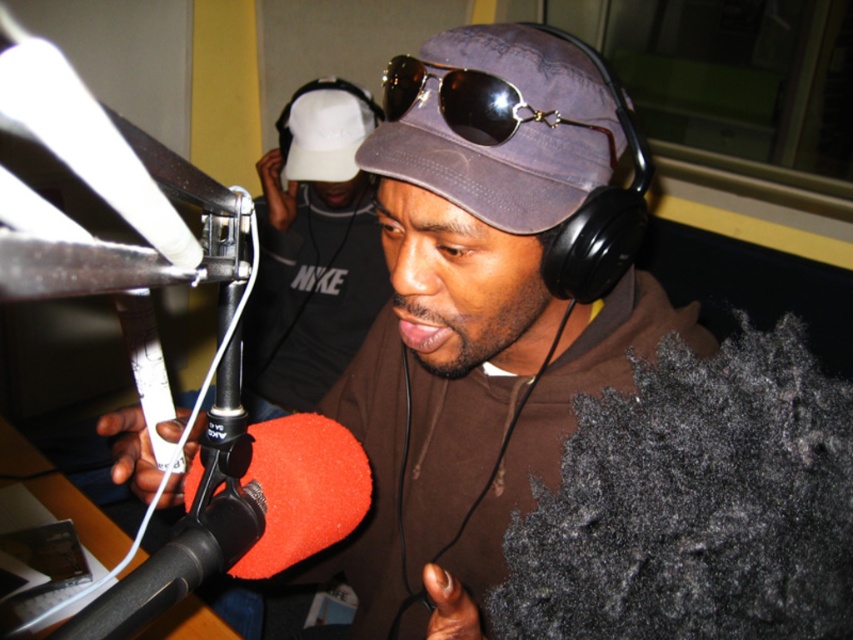
Question: Estimate the real-world distances between objects in this image. Which object is closer to the gold reflective aviator sunglasses at center?

Choices:
 (A) brown matte hoodie at center
 (B) purple canvas hat at center

Answer: (B)

Question: From the image, what is the correct spatial relationship of orange fuzzy microphone at center in relation to gold reflective aviator sunglasses at center?

Choices:
 (A) right
 (B) left

Answer: (B)

Question: Which object is farther from the camera taking this photo?

Choices:
 (A) gold reflective aviator sunglasses at center
 (B) orange fuzzy microphone at center

Answer: (A)

Question: Can you confirm if purple canvas hat at center is positioned above orange fuzzy microphone at center?

Choices:
 (A) yes
 (B) no

Answer: (A)

Question: Considering the real-world distances, which object is farthest from the gold reflective aviator sunglasses at center?

Choices:
 (A) white matte baseball cap at upper center
 (B) purple canvas hat at center
 (C) brown matte hoodie at center
 (D) orange fuzzy microphone at center

Answer: (A)

Question: Can you confirm if orange fuzzy microphone at center is thinner than white matte baseball cap at upper center?

Choices:
 (A) no
 (B) yes

Answer: (B)